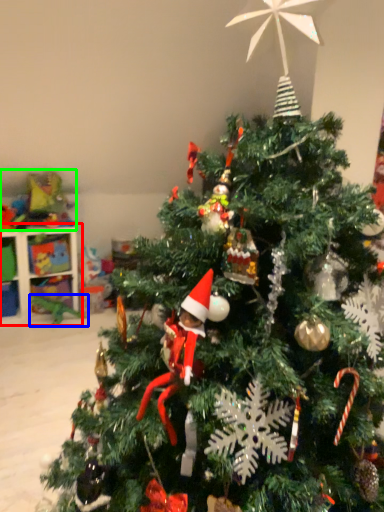
Question: Estimate the real-world distances between objects in this image. Which object is closer to shelf (highlighted by a red box), toy (highlighted by a blue box) or toy (highlighted by a green box)?

Choices:
 (A) toy
 (B) toy

Answer: (B)